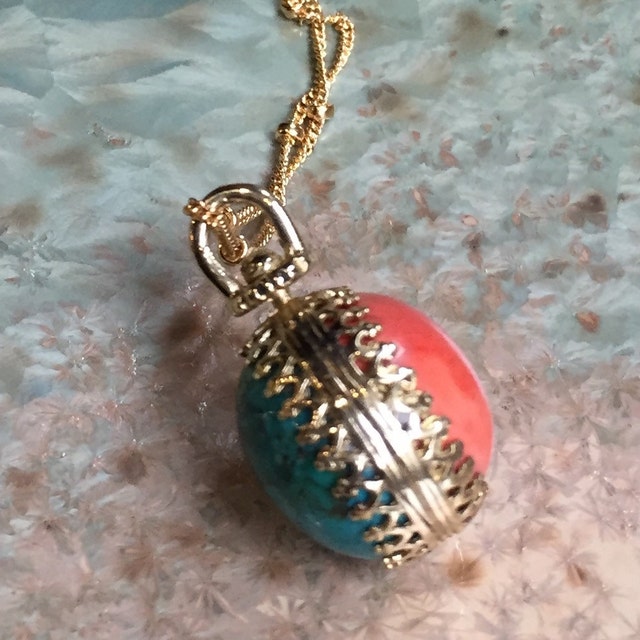
This screenshot has width=640, height=640. Identify the location of table. (107, 451).